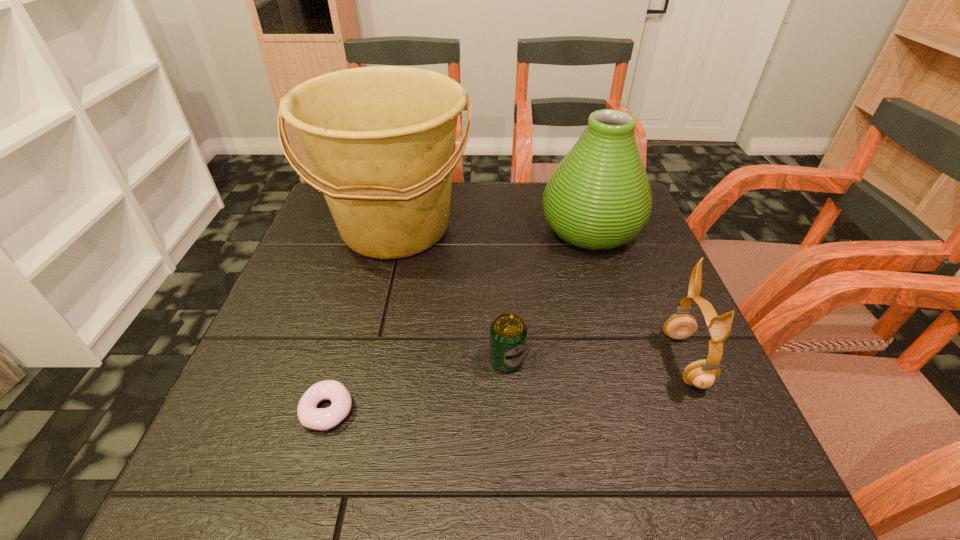
Where is `bucket`? The width and height of the screenshot is (960, 540). bucket is located at coordinates (381, 140).

Image resolution: width=960 pixels, height=540 pixels. Find the location of `vase`. vase is located at coordinates (599, 197).

This screenshot has width=960, height=540. What are the coordinates of `earphone` in the screenshot? It's located at (702, 373).

I want to click on the third object from right to left, so click(x=508, y=332).

Locate an element on the screen. beer can is located at coordinates (508, 332).

Find the location of a particular element. Image resolution: width=960 pixels, height=540 pixels. the shortest object is located at coordinates (310, 416).

You are a GUI agent. You are given a task and a screenshot of the screen. Output one action in this format:
    pyautogui.click(x=<x>, y=<y>)
    Task: Click on the free spot located on the side of the bucket with the handle
    Image resolution: width=960 pixels, height=540 pixels.
    Given the screenshot: What is the action you would take?
    click(373, 322)

You are a GUI agent. You are given a task and a screenshot of the screen. Output one action in this format:
    pyautogui.click(x=<x>, y=<y>)
    Task: Click on the free region located 0.180m on the front of the vase
    This screenshot has width=960, height=540.
    Given the screenshot: What is the action you would take?
    pyautogui.click(x=619, y=318)

Find the location of a particular element. The height and width of the screenshot is (540, 960). vacant region located on the front-facing side of the third tallest object is located at coordinates (631, 360).

At what (x,y) coordinates should I click in order to perform the action: click on vacant region located on the front-facing side of the third tallest object. Please return your answer as a coordinate pair (x, y). Looking at the image, I should click on (535, 360).